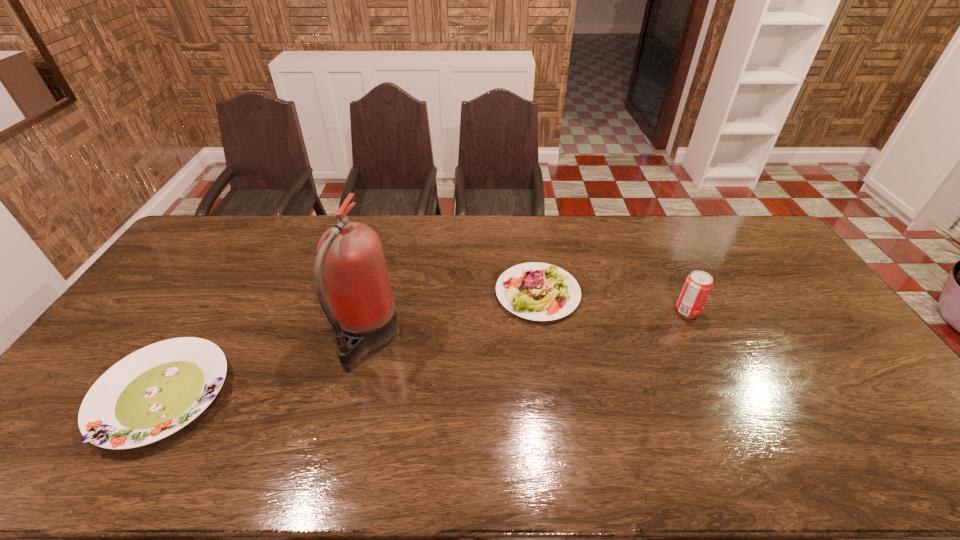
You are a GUI agent. You are given a task and a screenshot of the screen. Output one action in this format:
    pyautogui.click(x=<x>, y=<y>)
    Task: Click on the fire extinguisher
    
    Given the screenshot: What is the action you would take?
    pyautogui.click(x=350, y=257)

In order to click on the second object from left to right in this screenshot , I will do `click(350, 257)`.

The width and height of the screenshot is (960, 540). Find the location of `the second tallest object`. the second tallest object is located at coordinates pyautogui.click(x=698, y=285).

I want to click on the rightmost object, so click(x=698, y=285).

At what (x,y) coordinates should I click in order to perform the action: click on the right salad plate. Please return your answer as a coordinate pair (x, y). The image size is (960, 540). Looking at the image, I should click on (536, 291).

The height and width of the screenshot is (540, 960). What are the coordinates of `the farther salad plate` in the screenshot? It's located at (536, 291).

The width and height of the screenshot is (960, 540). Identify the location of the shortest object. (157, 390).

Locate an element on the screen. This screenshot has width=960, height=540. the left salad plate is located at coordinates (157, 390).

Locate an element on the screen. The height and width of the screenshot is (540, 960). free space located at the nozzle of the third object from right to left is located at coordinates (504, 340).

At what (x,y) coordinates should I click in order to perform the action: click on free spot located on the back of the rightmost object. Please return your answer as a coordinate pair (x, y). Looking at the image, I should click on (656, 246).